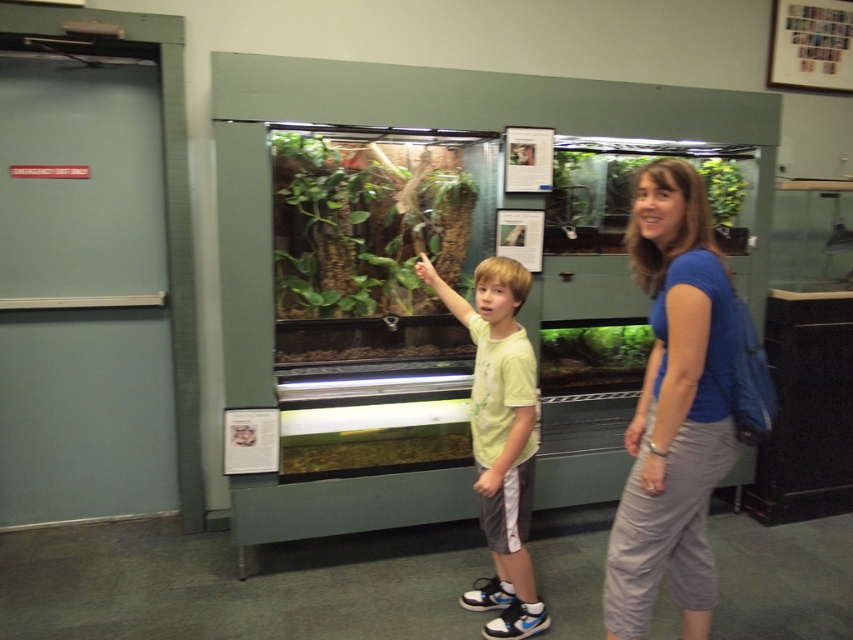
Question: Does blue fabric backpack at center-right appear on the left side of yellow matte shirt at center?

Choices:
 (A) no
 (B) yes

Answer: (A)

Question: Which of the following is the closest to the observer?

Choices:
 (A) yellow matte shirt at center
 (B) blue fabric backpack at center-right

Answer: (B)

Question: Does blue fabric backpack at center-right have a smaller size compared to yellow matte shirt at center?

Choices:
 (A) no
 (B) yes

Answer: (B)

Question: Can you confirm if blue fabric backpack at center-right is wider than yellow matte shirt at center?

Choices:
 (A) yes
 (B) no

Answer: (B)

Question: Which point is farther to the camera?

Choices:
 (A) yellow matte shirt at center
 (B) blue fabric backpack at center-right

Answer: (A)